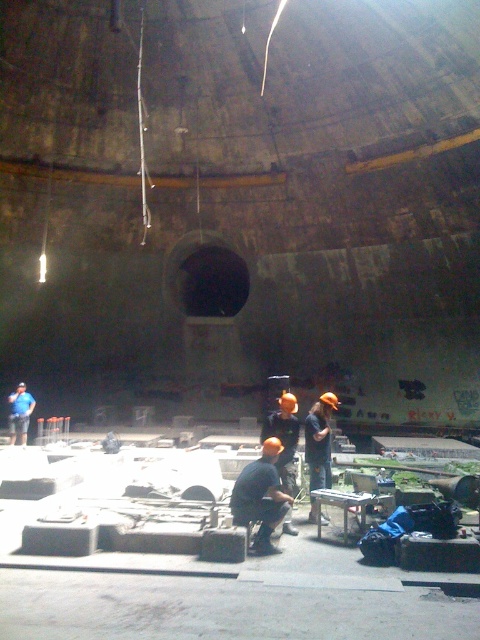
You are an inspector checking the construction site. You see the matte gray concrete blocks at center and the matte orange hard hat at center. Which object is larger in size?

The matte gray concrete blocks at center is bigger than the matte orange hard hat at center.

You are an inspector in this construction site. You notice the matte gray concrete blocks at center and the matte black shirt at center. Which object is positioned lower in the scene?

The matte gray concrete blocks at center is below matte black shirt at center, so the matte gray concrete blocks at center is positioned lower.